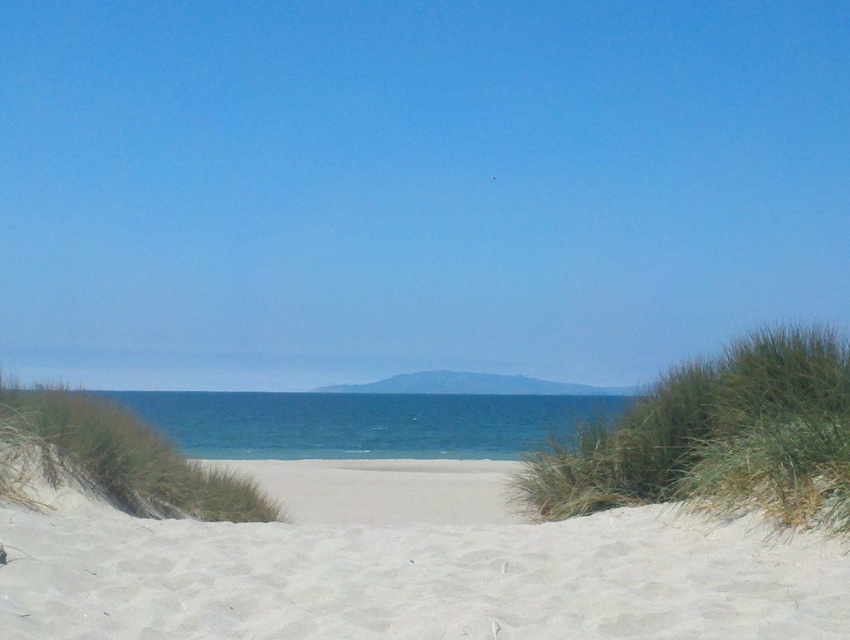
Does white sandy beach at center appear on the left side of blue water at center?

Indeed, white sandy beach at center is positioned on the left side of blue water at center.

Is point (106, 557) positioned before point (302, 426)?

Yes.

Is point (314, 496) less distant than point (462, 440)?

Yes, point (314, 496) is closer to viewer.

Locate an element on the screen. Image resolution: width=850 pixels, height=640 pixels. white sandy beach at center is located at coordinates (412, 566).